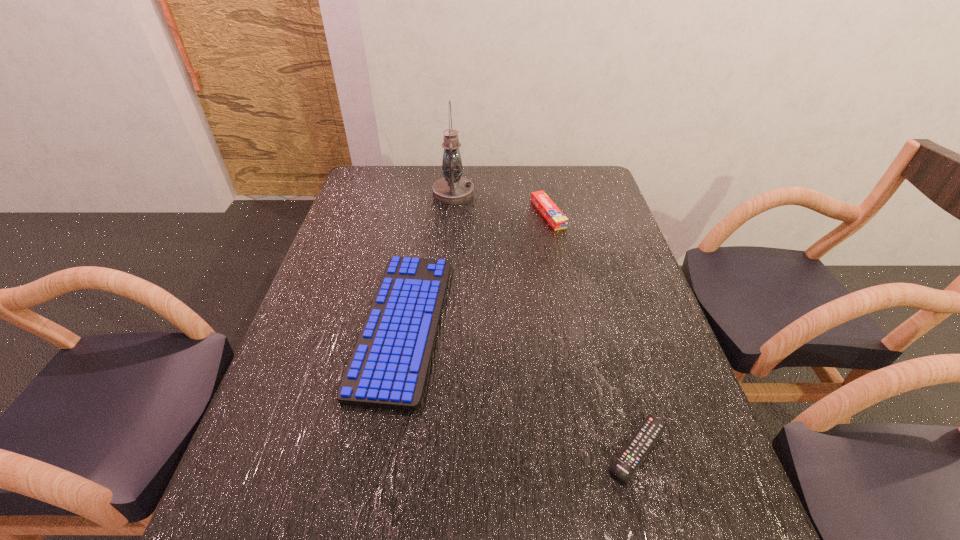
Find the location of a particular element. The image size is (960, 540). oil lamp located in the far edge section of the desktop is located at coordinates (452, 189).

Where is `toothpaste at the far edge`? The width and height of the screenshot is (960, 540). toothpaste at the far edge is located at coordinates (553, 215).

Locate an element on the screen. The height and width of the screenshot is (540, 960). object located at the left edge is located at coordinates (388, 368).

At what (x,y) coordinates should I click in order to perform the action: click on object located at the right edge. Please return your answer as a coordinate pair (x, y). The image size is (960, 540). Looking at the image, I should click on (628, 461).

Locate an element on the screen. free space at the far edge is located at coordinates (424, 190).

Find the location of a particular element. This screenshot has height=540, width=960. free space at the near edge of the desktop is located at coordinates (626, 537).

What are the coordinates of `vacant space at the left edge` in the screenshot? It's located at tap(326, 284).

What are the coordinates of `vacant position at the right edge of the desktop` in the screenshot? It's located at (646, 321).

Identify the location of vacant area at the far right corner. The width and height of the screenshot is (960, 540). (574, 185).

At what (x,y) coordinates should I click in order to perform the action: click on vacant region between the oil lamp and the second nearest object. Please return your answer as a coordinate pair (x, y). Image resolution: width=960 pixels, height=540 pixels. Looking at the image, I should click on (428, 259).